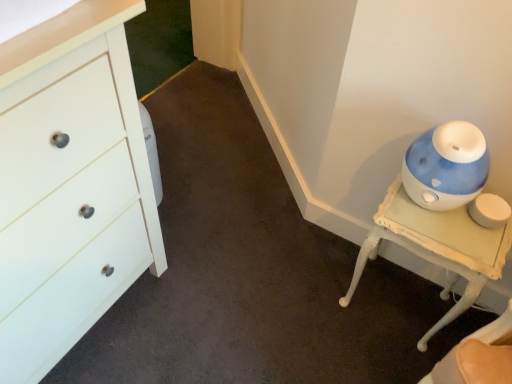
Locate an element on the screen. The image size is (512, 384). free point above blue glossy humidifier at right (from a real-world perspective) is located at coordinates (441, 221).